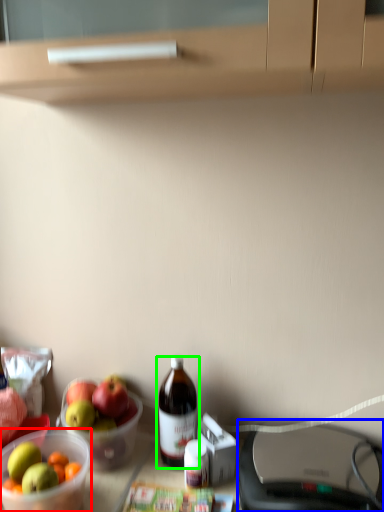
Question: Estimate the real-world distances between objects in this image. Which object is closer to bowl (highlighted by a red box), wide (highlighted by a blue box) or bottle (highlighted by a green box)?

Choices:
 (A) wide
 (B) bottle

Answer: (B)